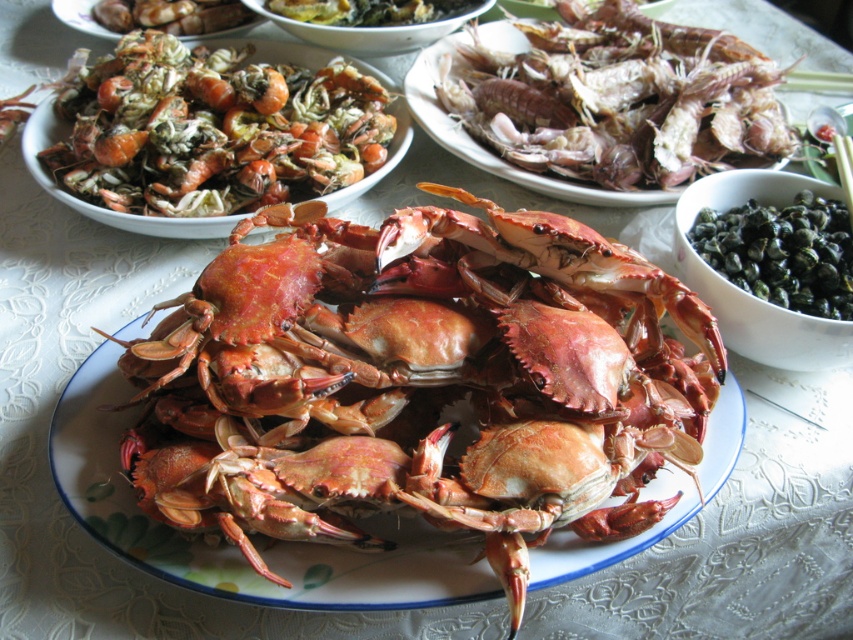
Question: Which object appears farthest from the camera in this image?

Choices:
 (A) shiny brown crab at center
 (B) matte brown shells at upper left
 (C) green matte bowl at upper center
 (D) green matte bowl at upper right

Answer: (B)

Question: Is shiny brown crab at center smaller than green matte bowl at upper center?

Choices:
 (A) yes
 (B) no

Answer: (B)

Question: Does shiny brown crab at center have a greater width compared to green matte bowl at upper right?

Choices:
 (A) yes
 (B) no

Answer: (A)

Question: Which point is closer to the camera?

Choices:
 (A) matte brown shells at upper left
 (B) shiny brown crab at center
 (C) shiny orange crab at upper left
 (D) brown matte crab at center

Answer: (B)

Question: Is green matte bowl at upper right closer to camera compared to matte brown shells at upper left?

Choices:
 (A) no
 (B) yes

Answer: (B)

Question: Which is farther from the shiny orange crab at upper left?

Choices:
 (A) green matte bowl at upper right
 (B) matte brown shells at upper left
 (C) green matte bowl at upper center
 (D) shiny brown crab at center

Answer: (A)